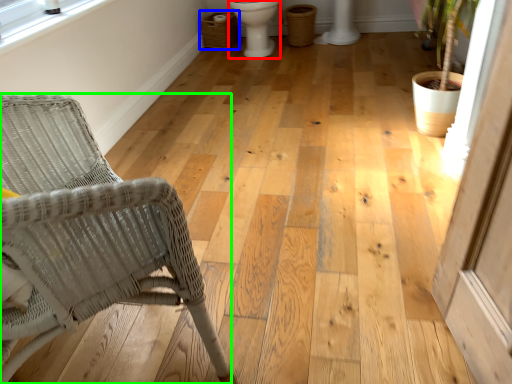
Question: Considering the real-world distances, which object is closest to toilet bowl (highlighted by a red box)? laundry basket (highlighted by a blue box) or chair (highlighted by a green box).

Choices:
 (A) laundry basket
 (B) chair

Answer: (A)